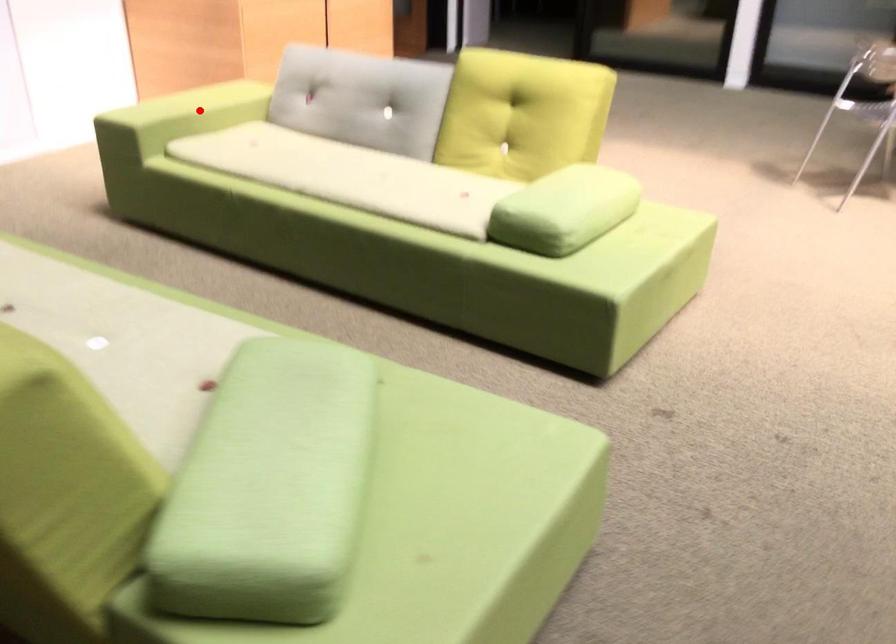
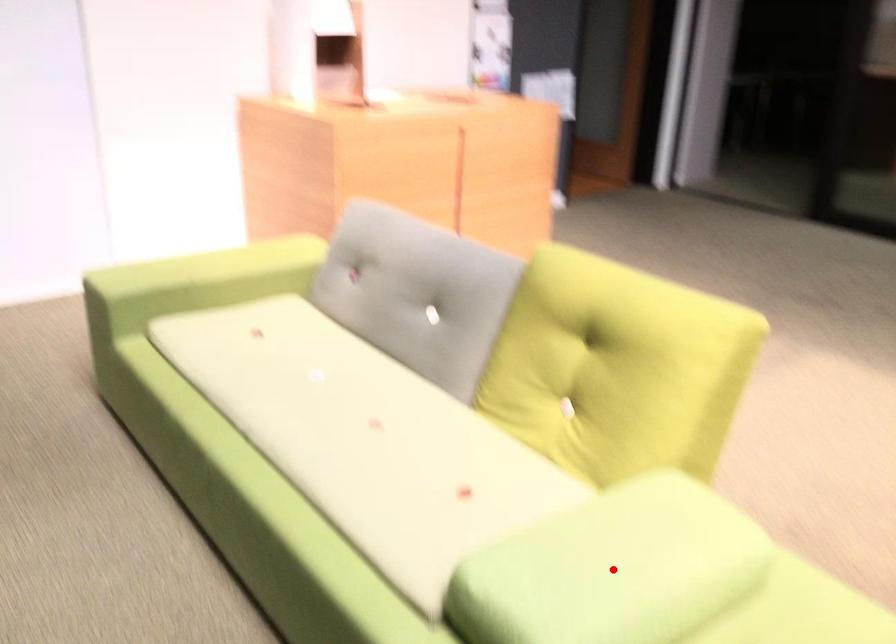
I am providing you with two images of the same scene from different viewpoints. A red point is marked on the first image and another point is marked on the second image. Does the point marked in image1 correspond to the same location as the one in image2?

No